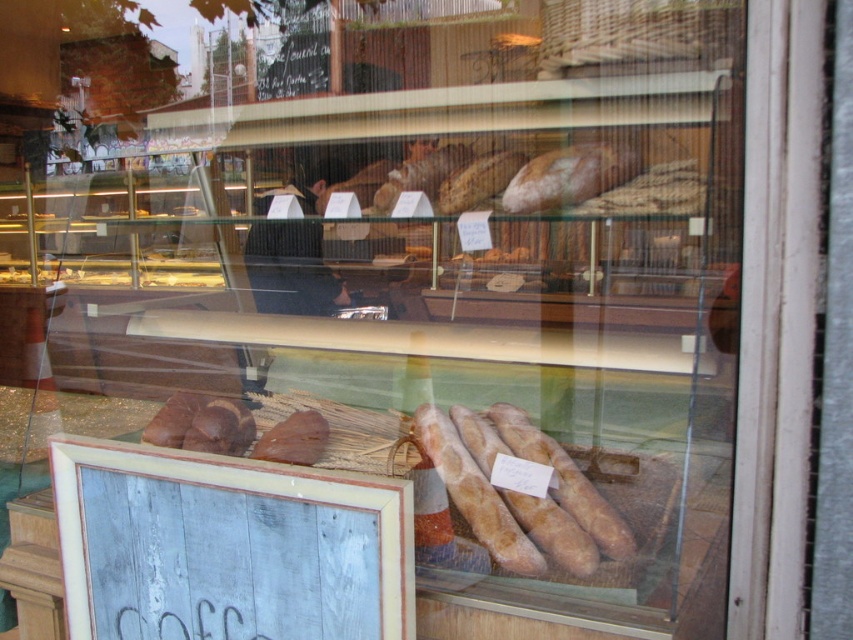
Question: Considering the relative positions of golden brown crusty baguette at center and brown matte bread at center in the image provided, where is golden brown crusty baguette at center located with respect to brown matte bread at center?

Choices:
 (A) right
 (B) left

Answer: (A)

Question: Is golden brown crusty baguette at center smaller than brown matte bread at center?

Choices:
 (A) yes
 (B) no

Answer: (B)

Question: Which point is closer to the camera?

Choices:
 (A) wooden signboard at lower left
 (B) brown matte bread at center

Answer: (A)

Question: Does golden brown crusty baguette at center appear over brown matte bread at center?

Choices:
 (A) yes
 (B) no

Answer: (B)

Question: Estimate the real-world distances between objects in this image. Which object is farther from the wooden signboard at lower left?

Choices:
 (A) golden brown crusty baguette at center
 (B) brown matte bread at center

Answer: (A)

Question: Which point is closer to the camera?

Choices:
 (A) golden brown crusty baguette at center
 (B) brown matte bread at center

Answer: (A)